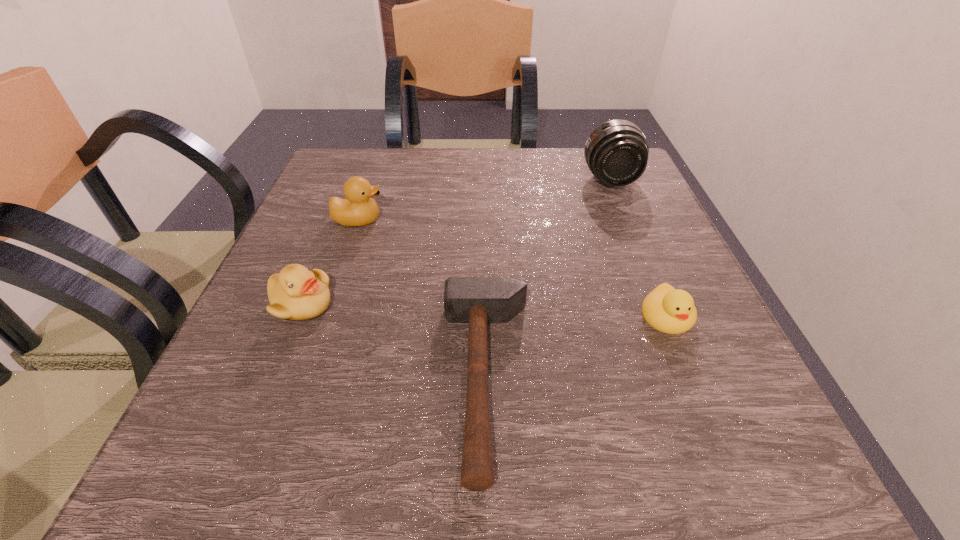
At what (x,y) coordinates should I click in order to perform the action: click on vacant space at the left edge of the desktop. Please return your answer as a coordinate pair (x, y). This screenshot has height=540, width=960. Looking at the image, I should click on (214, 397).

You are a GUI agent. You are given a task and a screenshot of the screen. Output one action in this format:
    pyautogui.click(x=<x>, y=<y>)
    Task: Click on the vacant space at the right edge of the desktop
    
    Given the screenshot: What is the action you would take?
    point(602,228)

Find the location of `free space at the far left corner`. free space at the far left corner is located at coordinates (390, 162).

Identify the location of vacant area at the far right corner. (632, 191).

Find the location of a particular element. empty space that is in between the third object from left to right and the rightmost duckling is located at coordinates (577, 348).

Image resolution: width=960 pixels, height=540 pixels. What are the coordinates of `vacant space that's between the telephoto lens and the shortest duckling` in the screenshot? It's located at (639, 249).

Find the location of a particular element. Image resolution: width=960 pixels, height=540 pixels. empty space between the shortest duckling and the farthest object is located at coordinates (639, 249).

The image size is (960, 540). What are the coordinates of `vacant point located between the farthest object and the fourth nearest object` in the screenshot? It's located at (485, 200).

Locate an element on the screen. This screenshot has height=540, width=960. empty space that is in between the second farthest object and the fourth tallest object is located at coordinates click(x=513, y=268).

Image resolution: width=960 pixels, height=540 pixels. I want to click on empty space that is in between the telephoto lens and the fourth tallest object, so click(639, 249).